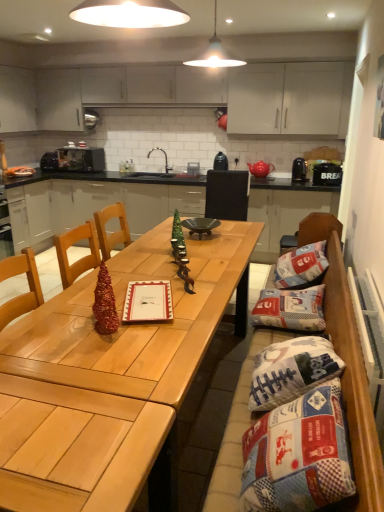
Where is `vacant space to the right of green matte christmas tree at center, which is counted as the 2th christmas tree, starting from the bottom`? The height and width of the screenshot is (512, 384). vacant space to the right of green matte christmas tree at center, which is counted as the 2th christmas tree, starting from the bottom is located at coordinates (203, 254).